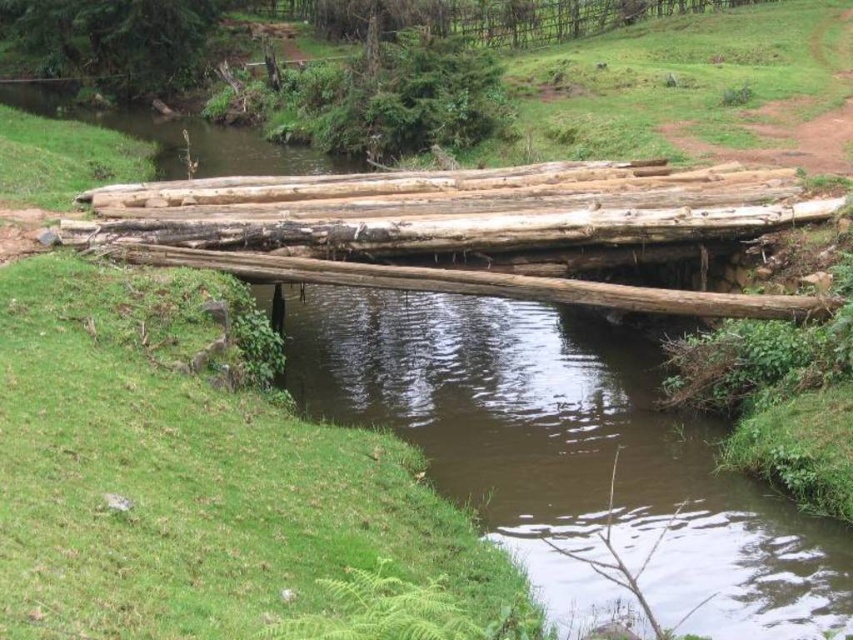
Between brown wood stream at center and natural wood logs at center, which one appears on the right side from the viewer's perspective?

From the viewer's perspective, brown wood stream at center appears more on the right side.

Does point (308, 397) come closer to viewer compared to point (577, 180)?

Yes, it is.

Find the location of a particular element. This screenshot has height=640, width=853. brown wood stream at center is located at coordinates (570, 456).